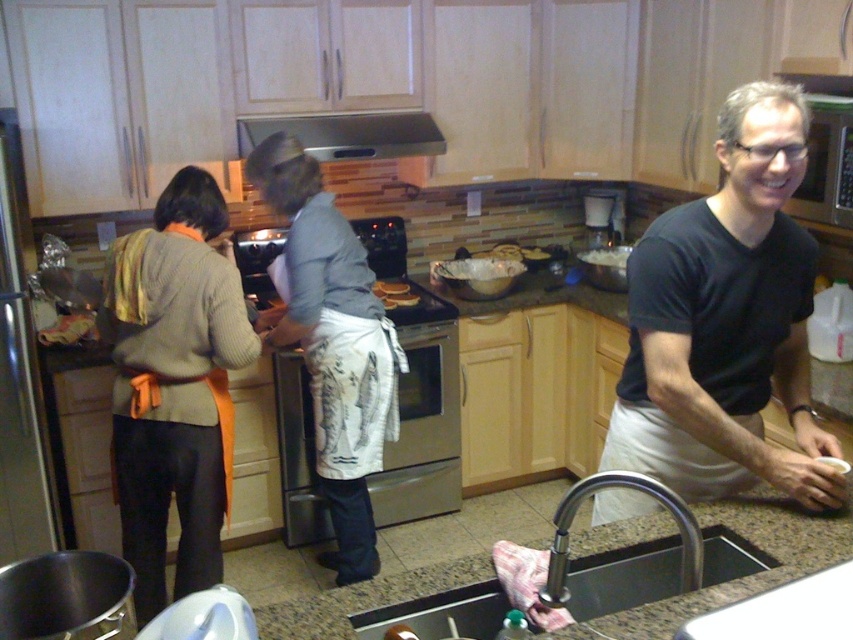
Can you confirm if stainless steel oven at center is wider than stainless steel exhaust hood at upper center?

No.

Does stainless steel oven at center have a lesser width compared to stainless steel exhaust hood at upper center?

Yes, stainless steel oven at center is thinner than stainless steel exhaust hood at upper center.

Which is behind, point (418, 324) or point (438, 129)?

Point (438, 129)

This screenshot has width=853, height=640. I want to click on stainless steel oven at center, so (416, 392).

Is white apron at center further to camera compared to stainless steel exhaust hood at upper center?

No.

Is white apron at center shorter than stainless steel exhaust hood at upper center?

No.

What do you see at coordinates (329, 340) in the screenshot?
I see `white apron at center` at bounding box center [329, 340].

Where is `white apron at center`? white apron at center is located at coordinates (329, 340).

Can you confirm if black matte shirt at right is bigger than matte white bread at center?

Yes, black matte shirt at right is bigger than matte white bread at center.

The image size is (853, 640). What are the coordinates of `black matte shirt at right` in the screenshot? It's located at (726, 323).

Does point (683, 208) come farther from viewer compared to point (386, 285)?

That is False.

This screenshot has width=853, height=640. In order to click on black matte shirt at right in this screenshot , I will do `click(726, 323)`.